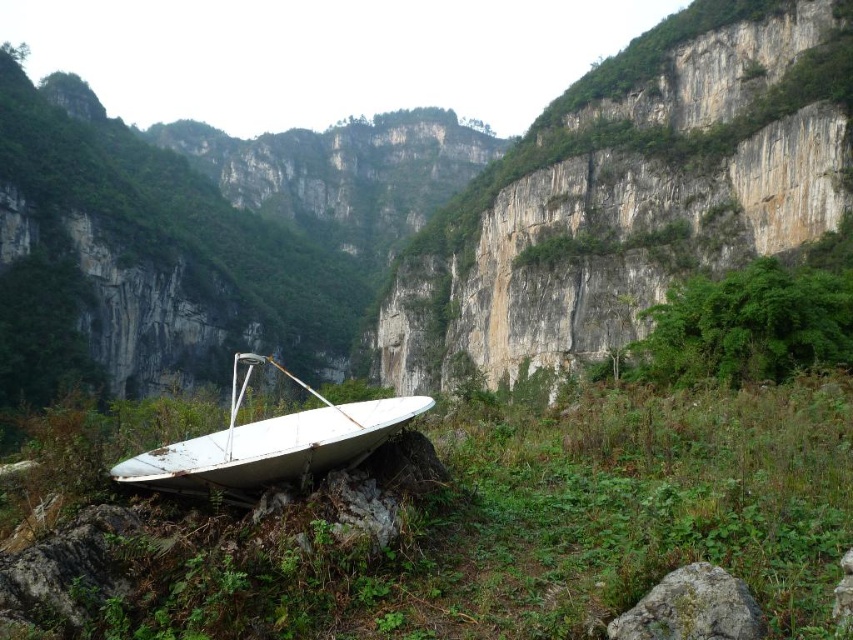
You are a hiker who wants to take a photo of the white matte boat at center from the rough stone cliff at center. Considering their sizes, which object should you focus on first to ensure both are in the frame?

The rough stone cliff at center is larger than the white matte boat at center, so you should focus on the rough stone cliff at center first to ensure both are in the frame.

You are standing at the base of the cliffs and want to determine which of the two points, point (630, 282) or point (624, 637), is closer to you. Based on the scene, which point is nearer?

Point (630, 282) is closer to you because it is further to the viewer than point (624, 637).